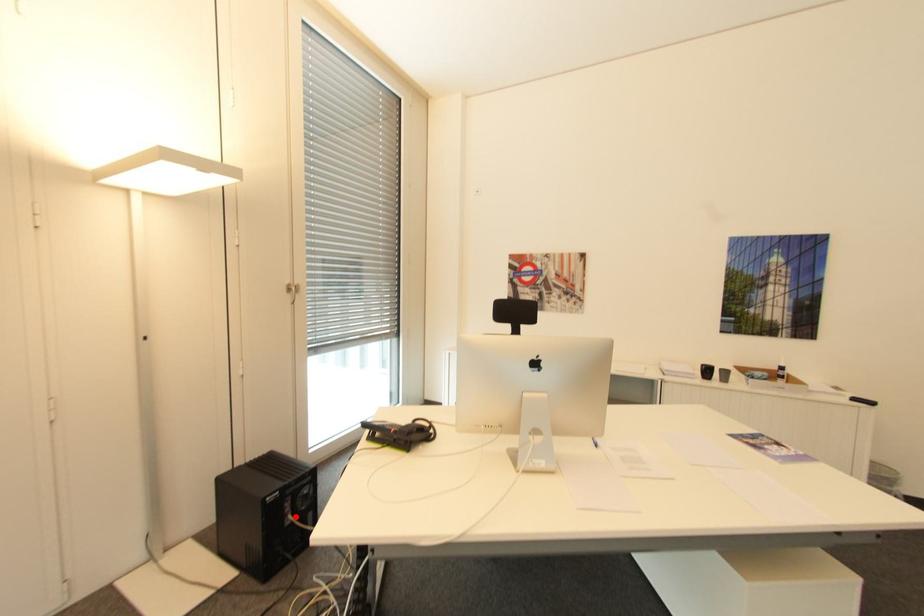
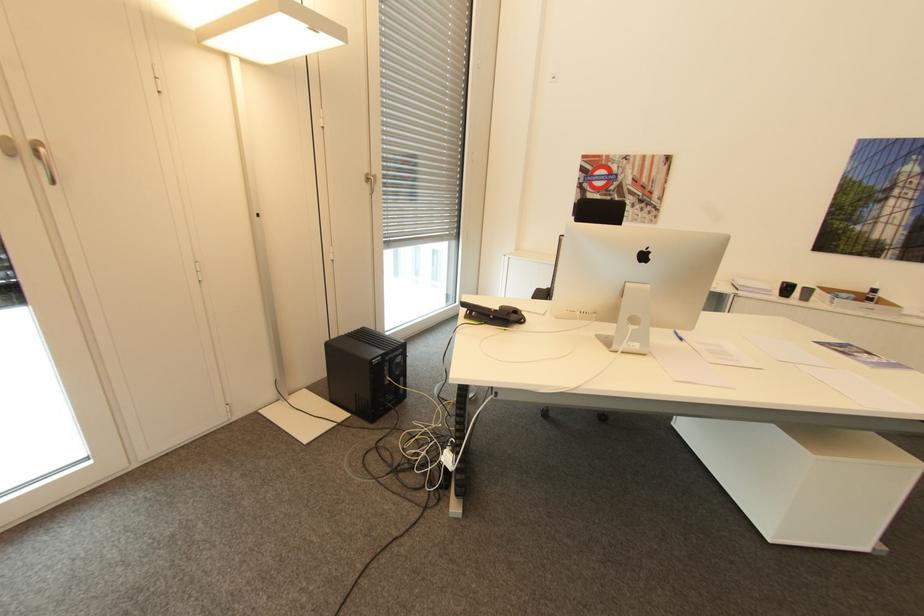
Question: I am providing you with two images of the same scene from different viewpoints. A red point is shown in image1. For the corresponding object point in image2, is it positioned nearer or farther from the camera?

Choices:
 (A) Nearer
 (B) Farther

Answer: (A)